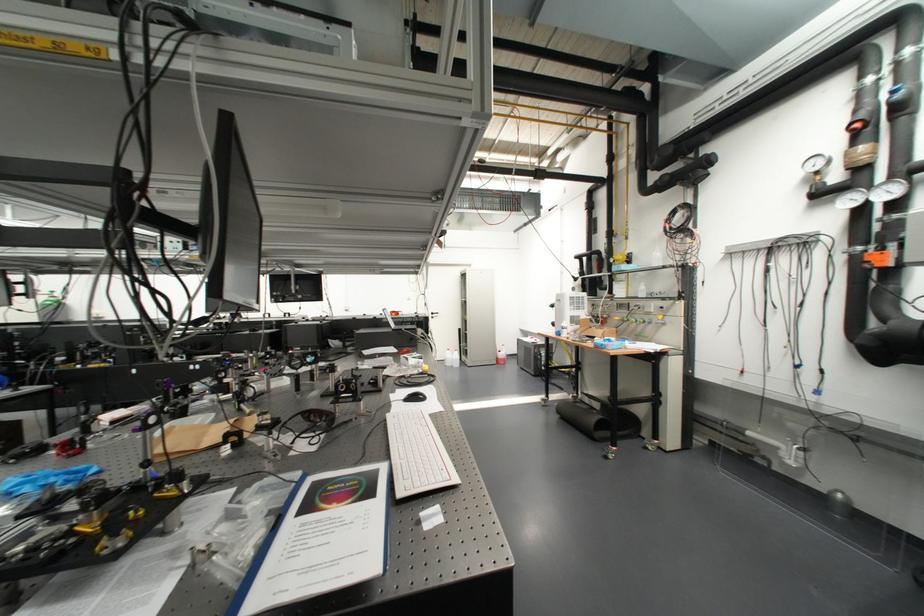
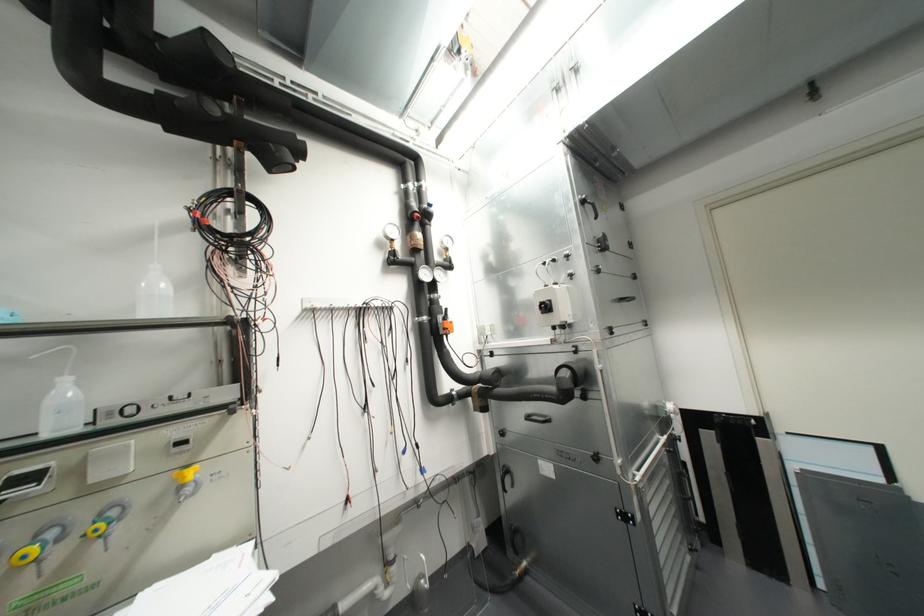
In the second image, find the point that corresponds to point (641, 283) in the first image.

(66, 379)